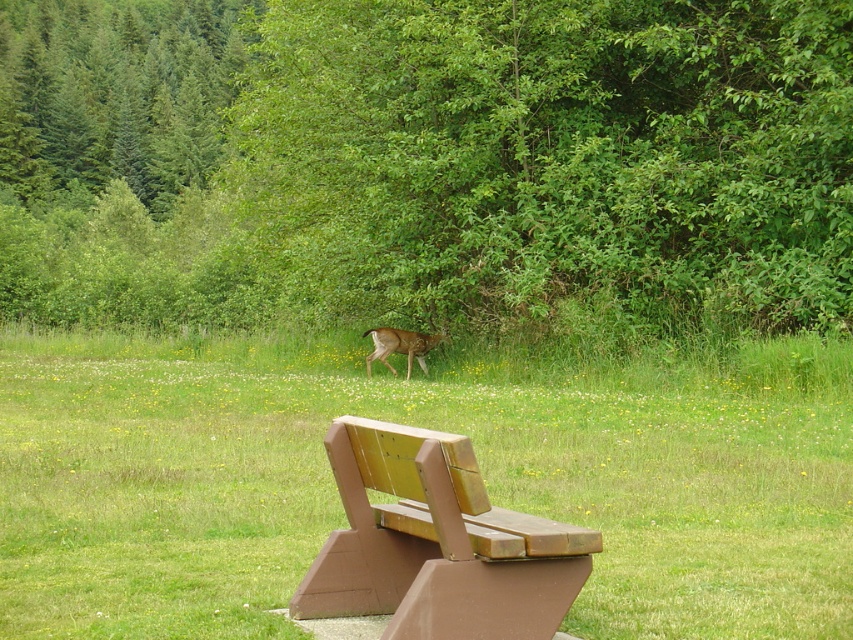
You are standing at point (424,608) and want to walk to the wooden bench in the foreground. Is the wooden bench in the foreground blocking your path to point (161,67)?

Point (161,67) is behind point (424,608), so the wooden bench in the foreground is blocking your path to point (161,67).

You are planning to place a new garden statue that is 1.2 meters tall in this outdoor area. Considering the green leafy tree at center and the brown wood bench at lower center, which object would the statue be taller than?

The green leafy tree at center is larger than the brown wood bench at lower center. Since the statue is 1.2 meters tall, it would be taller than the brown wood bench at lower center but shorter than the green leafy tree at center.

You are standing in the serene outdoor scene and want to take a photo of the brown fur deer at center. To get a better shot, you decide to move closer to the deer. However, there is a green leafy tree at center blocking your view. Which object should you move around to get an unobstructed view of the deer?

You should move around the green leafy tree at center because it is closer to you than the brown fur deer at center and is blocking your view. By moving around the tree, you can position yourself to see the deer without obstruction.